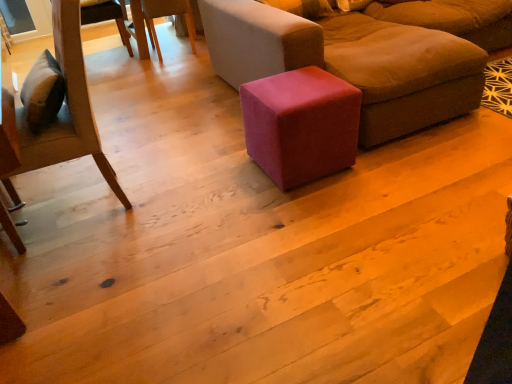
This screenshot has width=512, height=384. In order to click on free space to the right of wooden chair at left, which appears as the 1th chair when viewed from the front in this screenshot , I will do `click(176, 191)`.